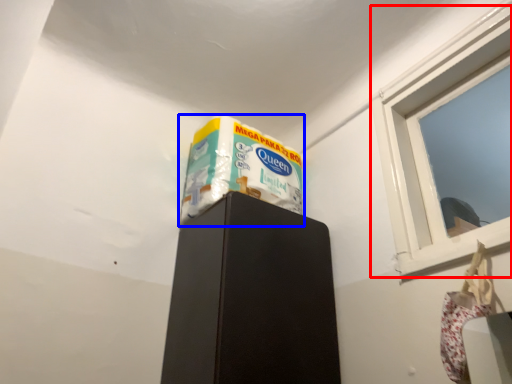
Question: Among these objects, which one is farthest to the camera, window (highlighted by a red box) or wrapping paper (highlighted by a blue box)?

Choices:
 (A) window
 (B) wrapping paper

Answer: (B)